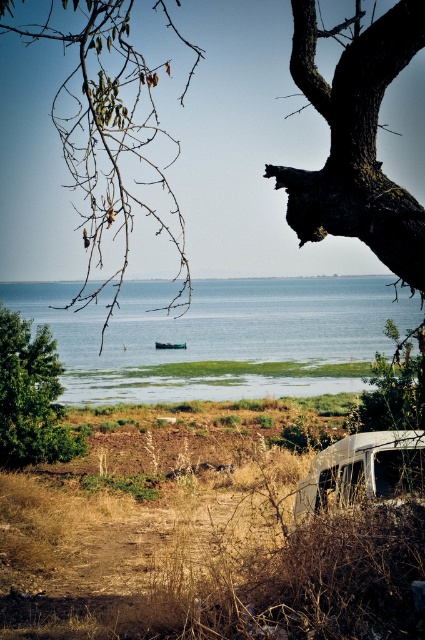
You are standing in the coastal landscape and want to walk from the green leafy tree at lower left to the green grassy water at center. Which direction should you head?

You should head to the right because the green grassy water at center is located to the right of the green leafy tree at lower left.